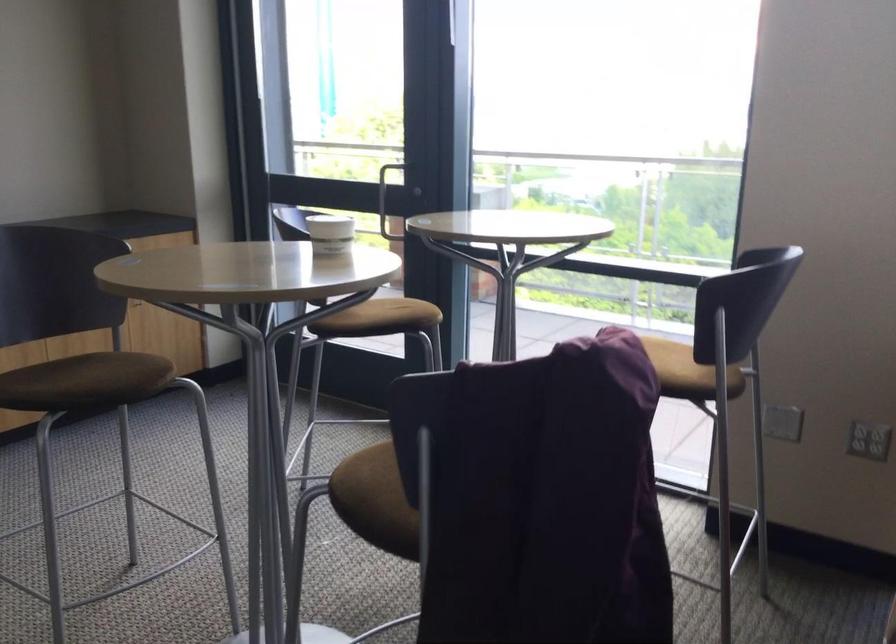
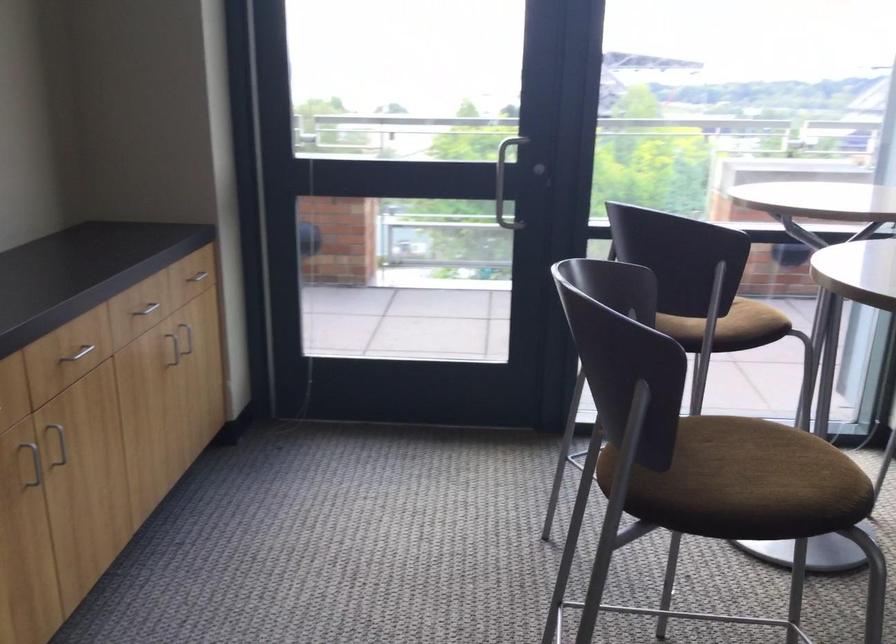
Where in the second image is the point corresponding to pixel 421 319 from the first image?

(748, 319)